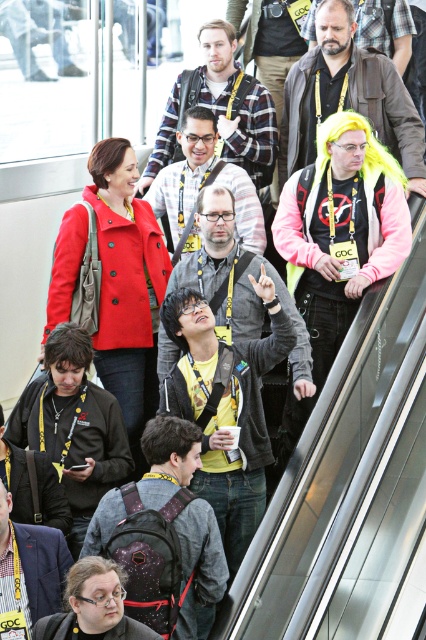
You are a photographer at the event and want to capture a photo of the shiny yellow wig at upper right and the matte gray hoodie at center without any obstruction. Based on their heights, which object should you focus on first to ensure it appears fully in the frame?

The shiny yellow wig at upper right is taller than the matte gray hoodie at center. Since it is taller, you should focus on the shiny yellow wig at upper right first to ensure it fits entirely within the frame.

You are a photographer at the event and want to capture a photo of the plaid shirt at upper center and the matte gray hoodie at center. If you frame the shot so that both are visible, which clothing item will appear wider in the photo?

The plaid shirt at upper center will appear wider in the photo because its width surpasses that of the matte gray hoodie at center.